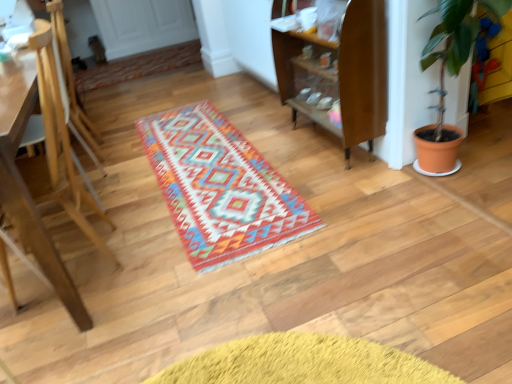
Question: Does wooden shelf at center come behind light brown wooden easel at left?

Choices:
 (A) no
 (B) yes

Answer: (B)

Question: Can you confirm if wooden shelf at center is bigger than light brown wooden easel at left?

Choices:
 (A) yes
 (B) no

Answer: (B)

Question: From a real-world perspective, is wooden shelf at center positioned over light brown wooden easel at left based on gravity?

Choices:
 (A) no
 (B) yes

Answer: (B)

Question: Does wooden shelf at center appear on the left side of light brown wooden easel at left?

Choices:
 (A) yes
 (B) no

Answer: (B)

Question: Considering the relative sizes of wooden shelf at center and light brown wooden easel at left in the image provided, is wooden shelf at center taller than light brown wooden easel at left?

Choices:
 (A) yes
 (B) no

Answer: (A)

Question: Is wooden shelf at center thinner than light brown wooden easel at left?

Choices:
 (A) no
 (B) yes

Answer: (B)

Question: Can you confirm if wooden shelf at center is shorter than wooden armchair at left?

Choices:
 (A) no
 (B) yes

Answer: (B)

Question: Is wooden armchair at left at the back of wooden shelf at center?

Choices:
 (A) yes
 (B) no

Answer: (B)

Question: From the image's perspective, would you say wooden shelf at center is positioned over wooden armchair at left?

Choices:
 (A) yes
 (B) no

Answer: (A)

Question: Is wooden shelf at center far from wooden armchair at left?

Choices:
 (A) no
 (B) yes

Answer: (B)

Question: Are wooden shelf at center and wooden armchair at left making contact?

Choices:
 (A) yes
 (B) no

Answer: (B)

Question: Is wooden shelf at center positioned behind wooden armchair at left?

Choices:
 (A) no
 (B) yes

Answer: (A)

Question: Is wooden armchair at left smaller than light brown wooden easel at left?

Choices:
 (A) no
 (B) yes

Answer: (B)